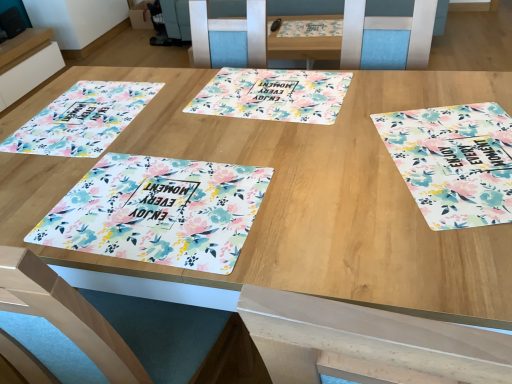
This screenshot has width=512, height=384. Find the location of `free point behind floral fabric placemat at right, which is the third tablecloth in left-to-right order`. free point behind floral fabric placemat at right, which is the third tablecloth in left-to-right order is located at coordinates point(392,93).